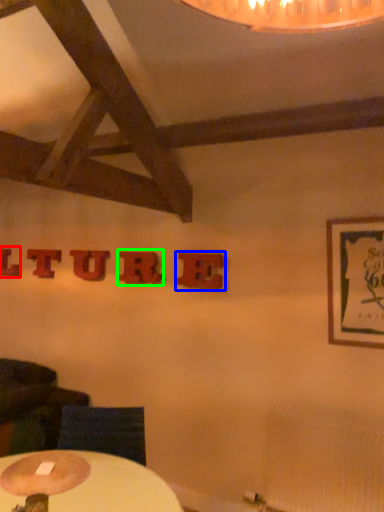
Question: Estimate the real-world distances between objects in this image. Which object is closer to letter (highlighted by a red box), letter (highlighted by a blue box) or letter (highlighted by a green box)?

Choices:
 (A) letter
 (B) letter

Answer: (B)